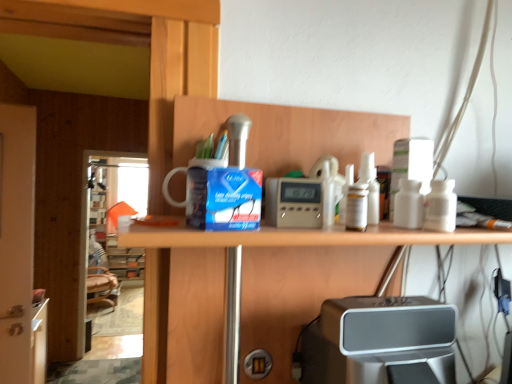
Question: From a real-world perspective, is silver metallic speaker at lower center physically above transparent glass screen door at left, the 2th screen door from the right?

Choices:
 (A) no
 (B) yes

Answer: (B)

Question: Is silver metallic speaker at lower center outside transparent glass screen door at left, marked as the second screen door in a front-to-back arrangement?

Choices:
 (A) no
 (B) yes

Answer: (B)

Question: From a real-world perspective, is silver metallic speaker at lower center physically below transparent glass screen door at left, arranged as the first screen door when viewed from the left?

Choices:
 (A) no
 (B) yes

Answer: (A)

Question: Considering the relative sizes of silver metallic speaker at lower center and transparent glass screen door at left, the first screen door from the back, in the image provided, is silver metallic speaker at lower center wider than transparent glass screen door at left, the first screen door from the back,?

Choices:
 (A) yes
 (B) no

Answer: (A)

Question: Is silver metallic speaker at lower center shorter than transparent glass screen door at left, the 2th screen door from the right?

Choices:
 (A) no
 (B) yes

Answer: (B)

Question: Can you confirm if silver metallic speaker at lower center is positioned to the right of transparent glass screen door at left, the 2th screen door from the right?

Choices:
 (A) yes
 (B) no

Answer: (A)

Question: Does matte digital clock at center have a smaller size compared to white glossy door at left, which ranks as the second screen door in left-to-right order?

Choices:
 (A) yes
 (B) no

Answer: (A)

Question: From the image's perspective, is matte digital clock at center on white glossy door at left, marked as the first screen door in a right-to-left arrangement?

Choices:
 (A) no
 (B) yes

Answer: (B)

Question: Is matte digital clock at center wider than white glossy door at left, which ranks as the second screen door in left-to-right order?

Choices:
 (A) no
 (B) yes

Answer: (A)

Question: Is matte digital clock at center not within white glossy door at left, marked as the first screen door in a right-to-left arrangement?

Choices:
 (A) no
 (B) yes

Answer: (B)

Question: Is matte digital clock at center thinner than white glossy door at left, which ranks as the second screen door in left-to-right order?

Choices:
 (A) yes
 (B) no

Answer: (A)

Question: Is matte digital clock at center positioned with its back to white glossy door at left, which ranks as the second screen door in left-to-right order?

Choices:
 (A) no
 (B) yes

Answer: (A)

Question: Can you confirm if transparent glass screen door at left, marked as the second screen door in a front-to-back arrangement, is smaller than silver metallic speaker at lower center?

Choices:
 (A) yes
 (B) no

Answer: (B)